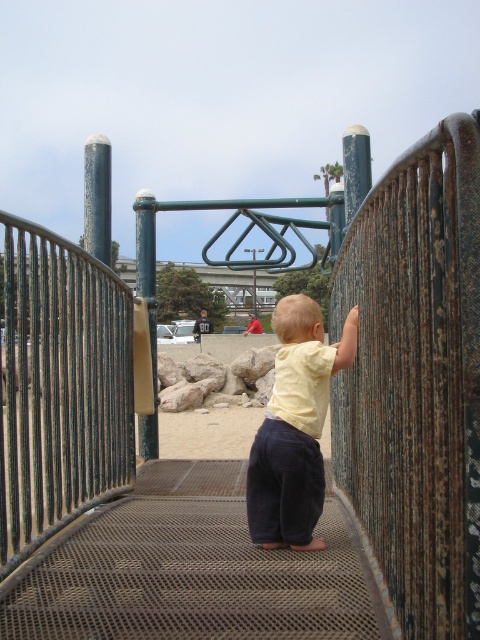
Based on the photo, you are a parent supervising a child on the playground. You see the rustic metal stairs at center and the yellow matte shirt at center. Which object is positioned to the left of the other?

The rustic metal stairs at center is to the left of the yellow matte shirt at center according to the description.

You are a parent supervising a child at the playground. The child is wearing a yellow matte shirt at center and standing near the rustic metal stairs at center. If you want to ensure the child can reach the top of the stairs, which object is shorter and might require the child to climb?

The rustic metal stairs at center is not as tall as the yellow matte shirt at center, so the child might need to climb the rustic metal stairs at center to reach the top since it is shorter than the child.

You are a photographer trying to capture a clear shot of the rustic metal stairs at center and the yellow matte shirt at center. Based on their positions, which object should you focus on first to ensure both are in focus?

You should focus on the rustic metal stairs at center first since it is closer to the viewer than the yellow matte shirt at center, allowing both to be in focus when using depth of field appropriately.